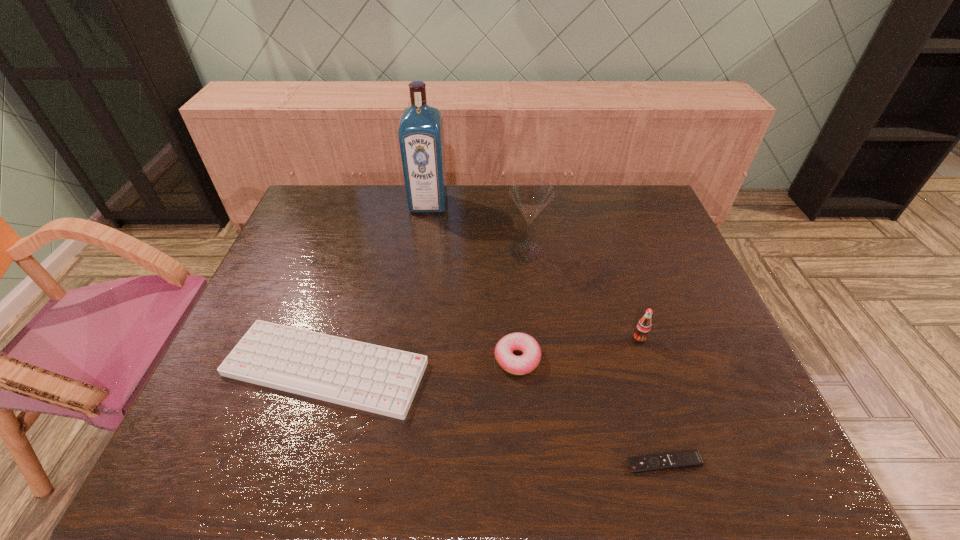
Locate an element on the screen. free space between the flute glass and the tallest object is located at coordinates (477, 227).

Identify the location of free space between the farthest object and the second shortest object. (377, 286).

Identify the location of vacant area that lies between the doughnut and the nearest object. The width and height of the screenshot is (960, 540). (590, 411).

At what (x,y) coordinates should I click in order to perform the action: click on object that stands as the closest to the liquor. Please return your answer as a coordinate pair (x, y). Image resolution: width=960 pixels, height=540 pixels. Looking at the image, I should click on click(x=531, y=196).

Identify the location of the third closest object to the soda. (531, 196).

Where is `free space that satisfies the following two spatial constraints: 1. on the flat label side of the tallest object; 2. on the right side of the remote control`? Image resolution: width=960 pixels, height=540 pixels. free space that satisfies the following two spatial constraints: 1. on the flat label side of the tallest object; 2. on the right side of the remote control is located at coordinates (391, 463).

Where is `vacant space that satisfies the following two spatial constraints: 1. on the flat label side of the liquor; 2. on the right side of the fourth tallest object`? The height and width of the screenshot is (540, 960). vacant space that satisfies the following two spatial constraints: 1. on the flat label side of the liquor; 2. on the right side of the fourth tallest object is located at coordinates (406, 359).

You are a GUI agent. You are given a task and a screenshot of the screen. Output one action in this format:
    pyautogui.click(x=<x>, y=<y>)
    Task: Click on the free space in the image that satisfies the following two spatial constraints: 1. on the flat label side of the liquor; 2. on the left side of the third shortest object
    The height and width of the screenshot is (540, 960).
    Given the screenshot: What is the action you would take?
    pyautogui.click(x=406, y=359)

Identify the location of vacant space that satisfies the following two spatial constraints: 1. on the flat label side of the tallest object; 2. on the left side of the fourth tallest object. (406, 359).

At what (x,y) coordinates should I click in order to perform the action: click on free spot that satisfies the following two spatial constraints: 1. on the front side of the third tallest object; 2. on the left side of the second tallest object. Please return your answer as a coordinate pair (x, y). This screenshot has height=540, width=960. Looking at the image, I should click on (537, 339).